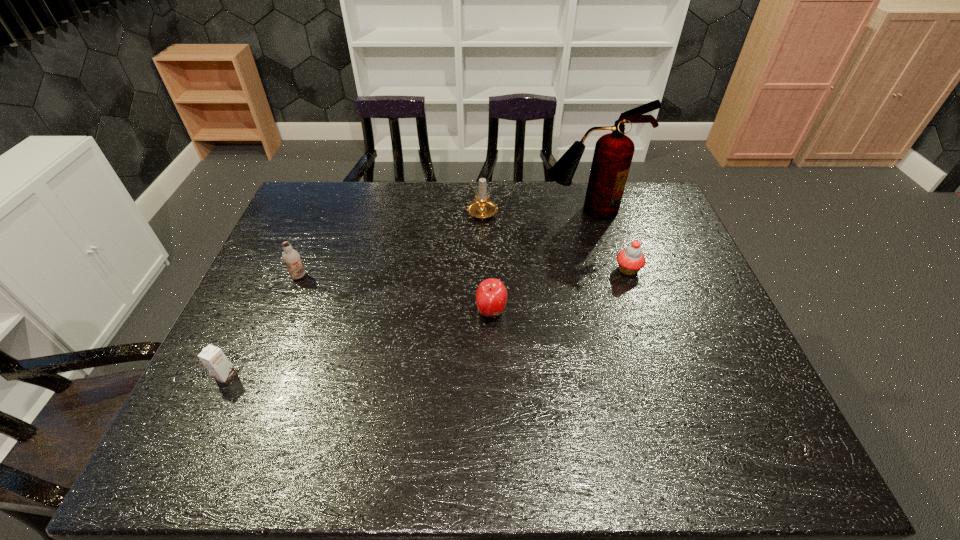
I want to click on vacant space in between the tallest object and the cupcake, so click(608, 240).

Where is `free space between the fire extinguisher and the candle`? This screenshot has width=960, height=540. free space between the fire extinguisher and the candle is located at coordinates (535, 212).

This screenshot has width=960, height=540. In order to click on vacant point located between the cupcake and the right chocolate milk in this screenshot , I will do `click(464, 273)`.

At what (x,y) coordinates should I click in order to perform the action: click on free space between the candle and the fire extinguisher. Please return your answer as a coordinate pair (x, y). Looking at the image, I should click on [535, 212].

Identify the location of vacant space that's between the right chocolate milk and the fire extinguisher. The image size is (960, 540). (444, 243).

Identify the location of blank region between the leftmost object and the fifth object from right to left. (263, 326).

This screenshot has width=960, height=540. What are the coordinates of `object identified as the second closest to the cupcake` in the screenshot? It's located at (491, 296).

This screenshot has width=960, height=540. Identify the location of object that is the third closest to the leftmost object. (482, 208).

Image resolution: width=960 pixels, height=540 pixels. I want to click on free space that satisfies the following two spatial constraints: 1. on the back side of the cupcake; 2. on the left side of the fifth farthest object, so click(491, 270).

The image size is (960, 540). Find the location of `free region that satisfies the following two spatial constraints: 1. at the nozzle of the cupcake; 2. on the right side of the fire extinguisher`. free region that satisfies the following two spatial constraints: 1. at the nozzle of the cupcake; 2. on the right side of the fire extinguisher is located at coordinates (605, 270).